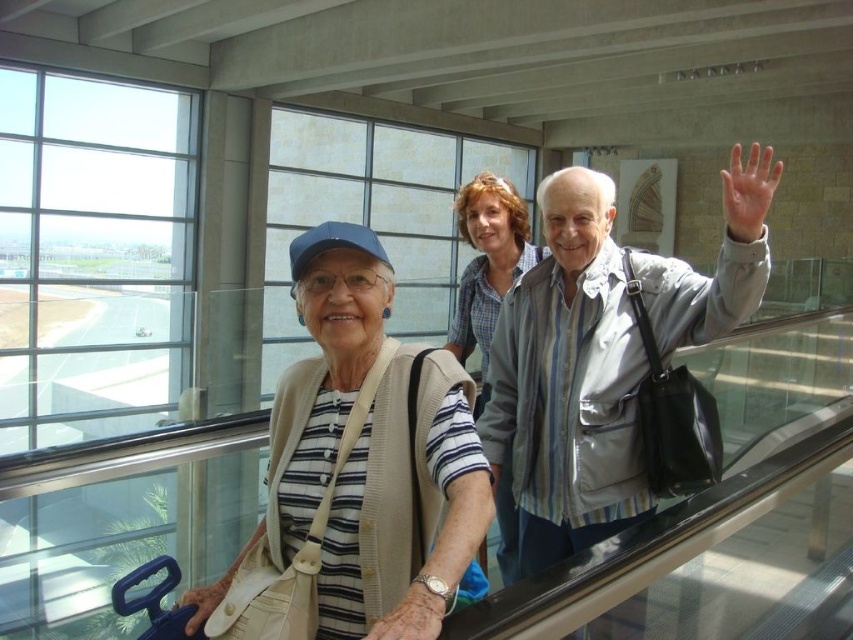
Who is higher up, matte beige sweater at center or gray striped shirt at center?

gray striped shirt at center

What do you see at coordinates (357, 470) in the screenshot?
I see `matte beige sweater at center` at bounding box center [357, 470].

Who is more forward, (309, 259) or (543, 224)?

Positioned in front is point (309, 259).

Find the location of a particular element. matte beige sweater at center is located at coordinates (357, 470).

Between point (457, 385) and point (596, 276), which one is positioned in front?

Point (457, 385)

Can you confirm if striped fabric shirt at center is smaller than gray striped shirt at center?

Incorrect, striped fabric shirt at center is not smaller in size than gray striped shirt at center.

Is point (328, 355) closer to camera compared to point (558, 387)?

Yes, point (328, 355) is in front of point (558, 387).

Locate an element on the screen. This screenshot has height=640, width=853. striped fabric shirt at center is located at coordinates (364, 461).

How distant is gray striped shirt at center from plaid shirt at center?

22.72 inches

Who is more forward, (560, 241) or (479, 208)?

Point (560, 241) is in front.

Find the location of a particular element. The image size is (853, 640). gray striped shirt at center is located at coordinates [x=567, y=381].